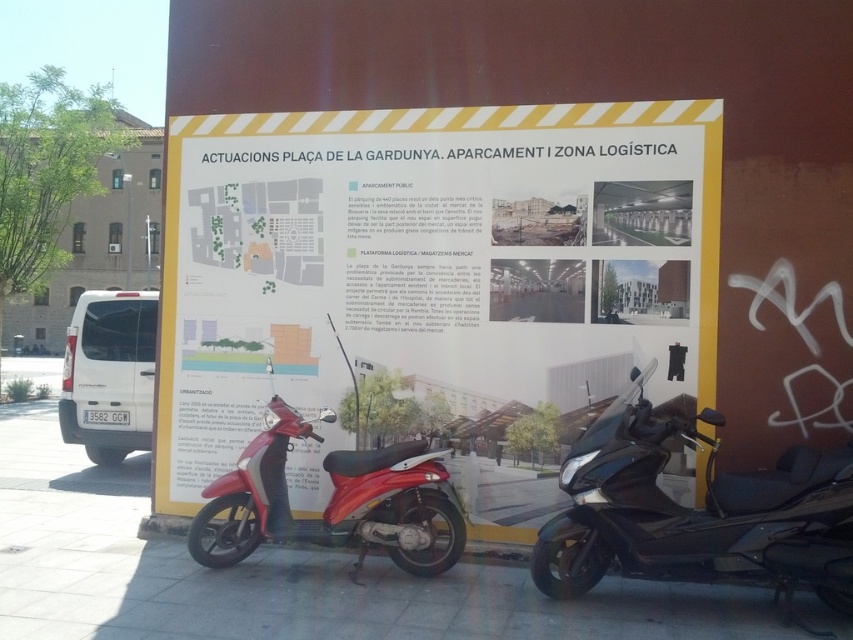
Question: Can you confirm if yellow paper poster at center is positioned to the left of shiny black scooter at lower right?

Choices:
 (A) yes
 (B) no

Answer: (A)

Question: In this image, where is yellow paper poster at center located relative to shiny red scooter at center?

Choices:
 (A) right
 (B) left

Answer: (A)

Question: Which object is the farthest from the shiny red scooter at center?

Choices:
 (A) yellow paper poster at center
 (B) shiny black scooter at lower right

Answer: (B)

Question: Can you confirm if shiny black scooter at lower right is wider than shiny red scooter at center?

Choices:
 (A) no
 (B) yes

Answer: (B)

Question: Among these points, which one is farthest from the camera?

Choices:
 (A) (355, 460)
 (B) (663, 525)
 (C) (566, 196)

Answer: (C)

Question: Which object is closer to the camera taking this photo?

Choices:
 (A) shiny red scooter at center
 (B) shiny black scooter at lower right

Answer: (B)